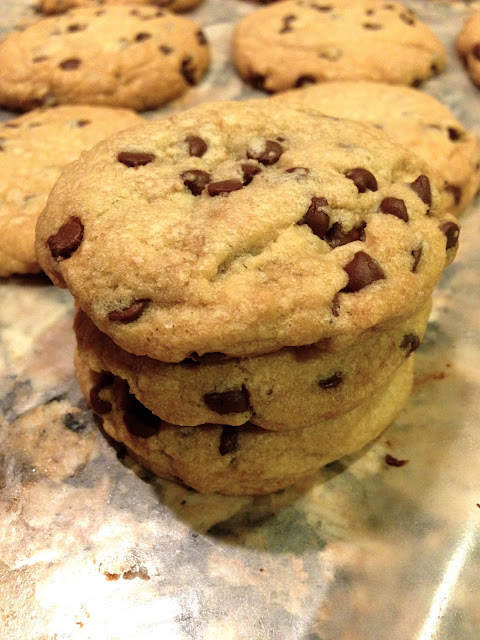
Locate an element on the screen. Image resolution: width=480 pixels, height=640 pixels. brown spots on counter is located at coordinates pyautogui.click(x=108, y=575), pyautogui.click(x=127, y=573), pyautogui.click(x=144, y=573).